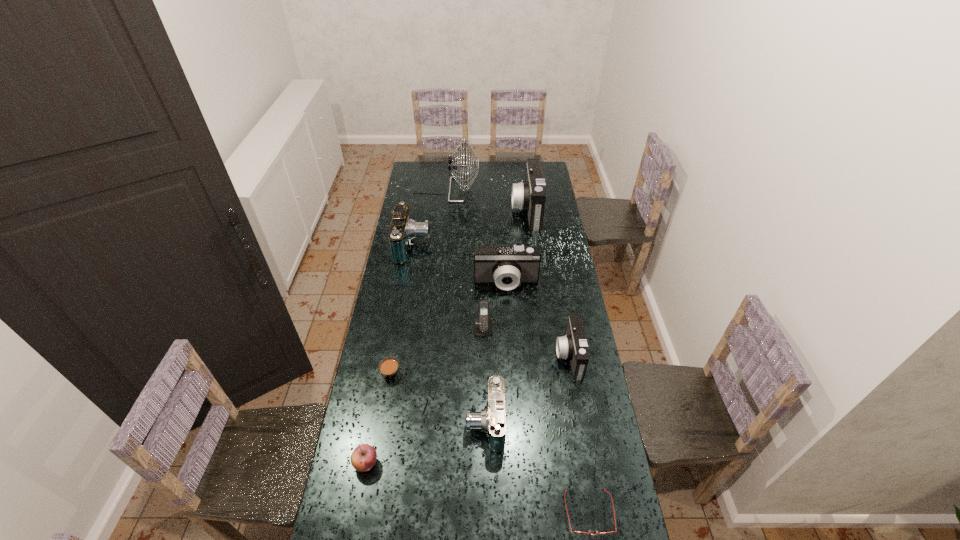
Where is `empty space that is in between the leftmost camcorder and the brown cappuccino`? Image resolution: width=960 pixels, height=540 pixels. empty space that is in between the leftmost camcorder and the brown cappuccino is located at coordinates (402, 309).

At what (x,y) coordinates should I click in order to perform the action: click on vacant region between the bigger blue camcorder and the apple. Please return your answer as a coordinate pair (x, y). This screenshot has height=540, width=960. Looking at the image, I should click on (390, 355).

Identify the location of object that is the second closest to the shortest object. (573, 346).

The height and width of the screenshot is (540, 960). In order to click on object that is the eighth closest to the fourth farthest camcorder in this screenshot , I will do `click(403, 229)`.

The height and width of the screenshot is (540, 960). I want to click on the second closest camcorder to the cellular telephone, so click(573, 346).

You are a GUI agent. You are given a task and a screenshot of the screen. Output one action in this format:
    pyautogui.click(x=<x>, y=<y>)
    Task: Click on the camcorder that can be found as the closest to the cellular telephone
    The image size is (960, 540).
    Given the screenshot: What is the action you would take?
    505,265

The image size is (960, 540). In order to click on black camcorder that is the second closest to the apple in this screenshot , I will do `click(505, 265)`.

Select which black camcorder appears as the second closest to the cellular telephone. Please provide its 2D coordinates. Your answer should be formatted as a tuple, i.e. [(x, y)], where the tuple contains the x and y coordinates of a point satisfying the conditions above.

[(573, 346)]